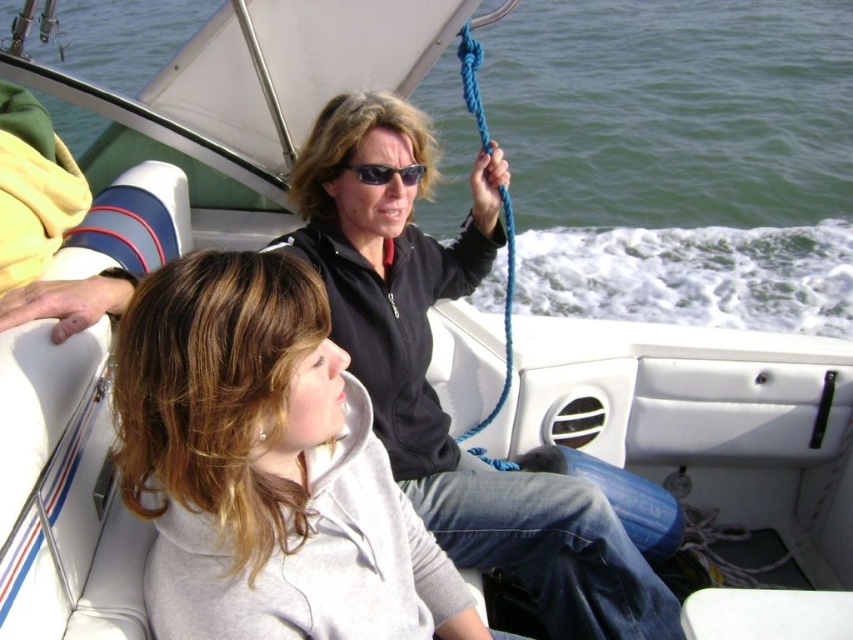
Does gray fleece jacket at center appear over black matte jacket at upper center?

Incorrect, gray fleece jacket at center is not positioned above black matte jacket at upper center.

Is gray fleece jacket at center positioned before black matte jacket at upper center?

Yes, it is.

Is point (325, 429) behind point (663, 604)?

No, (325, 429) is closer to viewer.

Where is `gray fleece jacket at center`? Image resolution: width=853 pixels, height=640 pixels. gray fleece jacket at center is located at coordinates (265, 465).

Can you confirm if black matte jacket at upper center is wider than black plastic sunglasses at center?

Indeed, black matte jacket at upper center has a greater width compared to black plastic sunglasses at center.

Does black matte jacket at upper center appear on the left side of black plastic sunglasses at center?

In fact, black matte jacket at upper center is to the right of black plastic sunglasses at center.

Does point (560, 513) lie in front of point (399, 179)?

Yes, it is.

Locate an element on the screen. The height and width of the screenshot is (640, 853). black matte jacket at upper center is located at coordinates (433, 388).

Who is lower down, gray fleece jacket at center or black plastic sunglasses at center?

gray fleece jacket at center is below.

In the scene shown: Which of these two, gray fleece jacket at center or black plastic sunglasses at center, stands shorter?

With less height is black plastic sunglasses at center.

Which is behind, point (263, 403) or point (386, 182)?

The point (386, 182) is behind.

The height and width of the screenshot is (640, 853). In order to click on gray fleece jacket at center in this screenshot , I will do `click(265, 465)`.